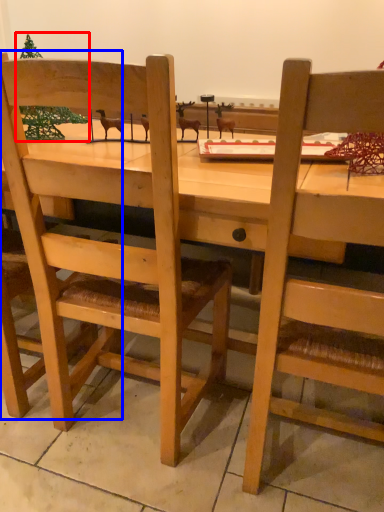
Question: Which object appears closest to the camera in this image, christmas tree (highlighted by a red box) or chair (highlighted by a blue box)?

Choices:
 (A) christmas tree
 (B) chair

Answer: (B)